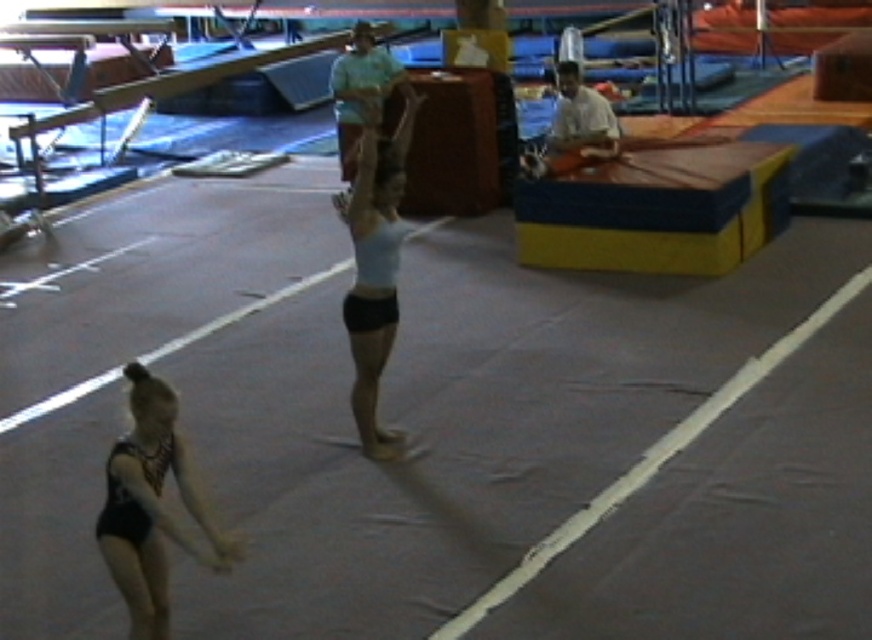
You are a photographer standing at the camera position. You want to take a closeup photo of the black leotard at lower left. Considering the distance, will you need to zoom in or zoom out to focus on it?

The black leotard at lower left is 4.49 meters away from camera, so you will need to zoom in to focus on it.

You are a photographer positioned at the entrance of the gym. You need to capture a clear shot of the black leotard at lower left and the light blue fabric at center. Which object should you focus on first to ensure both are in focus?

The black leotard at lower left is in front of the light blue fabric at center, so you should focus on the black leotard at lower left first to ensure both are in focus.

You are a photographer setting up for a gymnastics competition. You need to ensure that the black leotard at lower left and the light blue fabric at center are both visible in your shot. Based on their sizes, which object should you prioritize framing closer to the camera?

The black leotard at lower left occupies less space than the light blue fabric at center, so you should prioritize framing the light blue fabric at center closer to the camera to ensure it is visible.